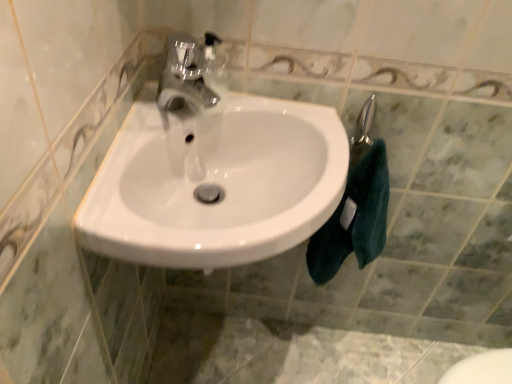
Question: Is dark teal towel at right far from white glossy sink at center?

Choices:
 (A) no
 (B) yes

Answer: (A)

Question: From a real-world perspective, is dark teal towel at right under white glossy sink at center?

Choices:
 (A) yes
 (B) no

Answer: (A)

Question: Is dark teal towel at right positioned with its back to white glossy sink at center?

Choices:
 (A) yes
 (B) no

Answer: (B)

Question: Can you confirm if dark teal towel at right is positioned to the right of white glossy sink at center?

Choices:
 (A) yes
 (B) no

Answer: (A)

Question: Is white glossy sink at center completely or partially inside dark teal towel at right?

Choices:
 (A) no
 (B) yes

Answer: (A)

Question: From the image's perspective, is dark teal towel at right on top of white glossy sink at center?

Choices:
 (A) no
 (B) yes

Answer: (A)

Question: Does white glossy sink at center have a larger size compared to dark teal towel at right?

Choices:
 (A) no
 (B) yes

Answer: (B)

Question: From the image's perspective, is white glossy sink at center on top of dark teal towel at right?

Choices:
 (A) no
 (B) yes

Answer: (B)

Question: Are white glossy sink at center and dark teal towel at right far apart?

Choices:
 (A) yes
 (B) no

Answer: (B)

Question: From a real-world perspective, is white glossy sink at center physically above dark teal towel at right?

Choices:
 (A) yes
 (B) no

Answer: (A)

Question: Is white glossy sink at center shorter than dark teal towel at right?

Choices:
 (A) no
 (B) yes

Answer: (B)

Question: Does white glossy sink at center appear on the right side of dark teal towel at right?

Choices:
 (A) no
 (B) yes

Answer: (A)

Question: Considering the positions of dark teal towel at right and white glossy sink at center in the image, is dark teal towel at right wider or thinner than white glossy sink at center?

Choices:
 (A) thin
 (B) wide

Answer: (A)